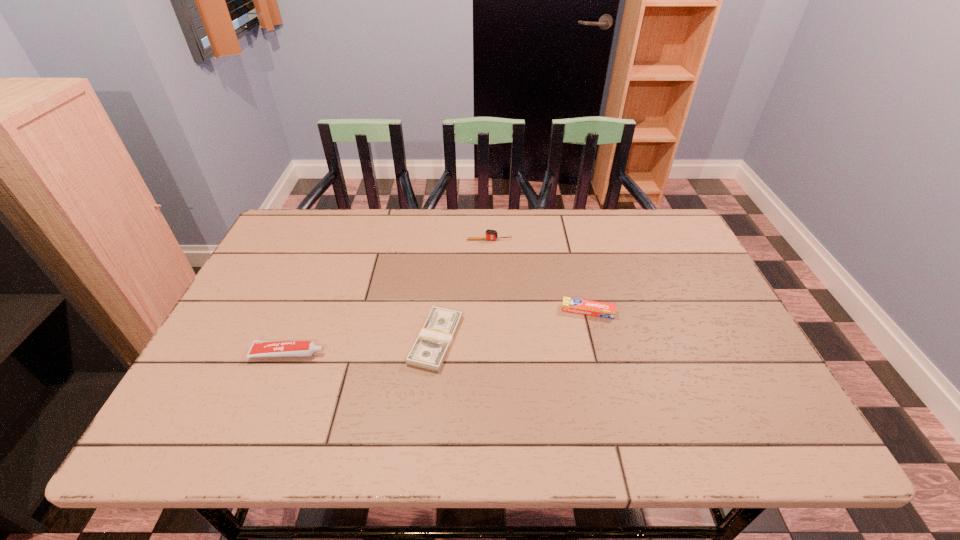
I want to click on free spot between the shortest object and the leftmost object, so click(x=362, y=347).

Where is `vacant area that lies between the second object from right to left and the farther toothpaste`? vacant area that lies between the second object from right to left and the farther toothpaste is located at coordinates (539, 275).

Locate an element on the screen. The width and height of the screenshot is (960, 540). empty location between the farthest object and the leftmost object is located at coordinates (389, 296).

The height and width of the screenshot is (540, 960). I want to click on unoccupied area between the shortest object and the rightmost object, so click(x=512, y=326).

This screenshot has height=540, width=960. What are the coordinates of `free space between the shortest object and the rightmost object` in the screenshot? It's located at (512, 326).

This screenshot has width=960, height=540. What are the coordinates of `unoccupied position between the shortest object and the left toothpaste` in the screenshot? It's located at (362, 347).

Image resolution: width=960 pixels, height=540 pixels. I want to click on free point between the right toothpaste and the tape measure, so click(x=539, y=275).

Identify which object is the third nearest to the second object from left to right. Please provide its 2D coordinates. Your answer should be formatted as a tuple, i.e. [(x, y)], where the tuple contains the x and y coordinates of a point satisfying the conditions above.

[(490, 234)]

This screenshot has width=960, height=540. What are the coordinates of `object that stands as the third closest to the right toothpaste` in the screenshot? It's located at (259, 348).

The image size is (960, 540). Identify the location of vacant space that satisfies the following two spatial constraints: 1. on the front side of the shortest object; 2. at the nozzle of the nearer toothpaste. (435, 354).